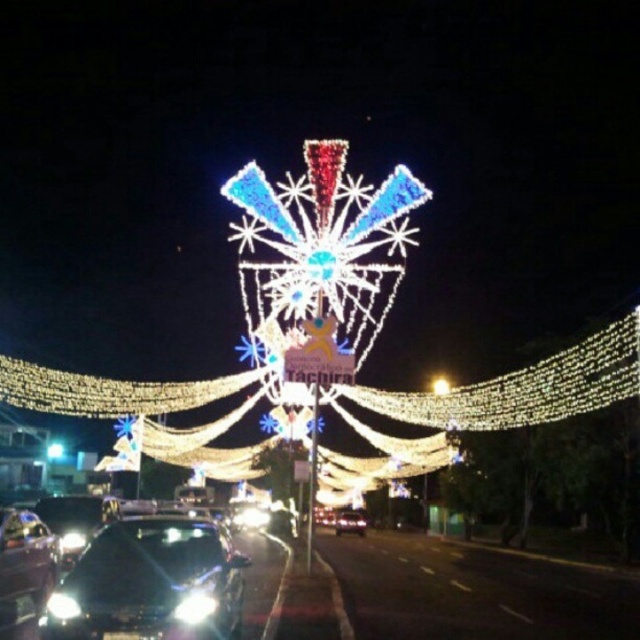
Question: Is the position of illuminated lights at center less distant than that of glossy black car at center?

Choices:
 (A) yes
 (B) no

Answer: (A)

Question: Which object is positioned farthest from the illuminated starburst at center?

Choices:
 (A) illuminated lights at center
 (B) shiny black car at lower left
 (C) glossy black car at lower left
 (D) glossy black car at center

Answer: (B)

Question: Among these points, which one is nearest to the camera?

Choices:
 (A) (97, 397)
 (B) (435, 390)
 (C) (196, 557)
 (D) (356, 524)

Answer: (C)

Question: Which of the following is the farthest from the observer?

Choices:
 (A) (612, 374)
 (B) (353, 524)

Answer: (B)

Question: Is glossy black car at center above illuminated starburst at center?

Choices:
 (A) yes
 (B) no

Answer: (B)

Question: Is illuminated lights at center to the left of glossy black car at lower left from the viewer's perspective?

Choices:
 (A) yes
 (B) no

Answer: (B)